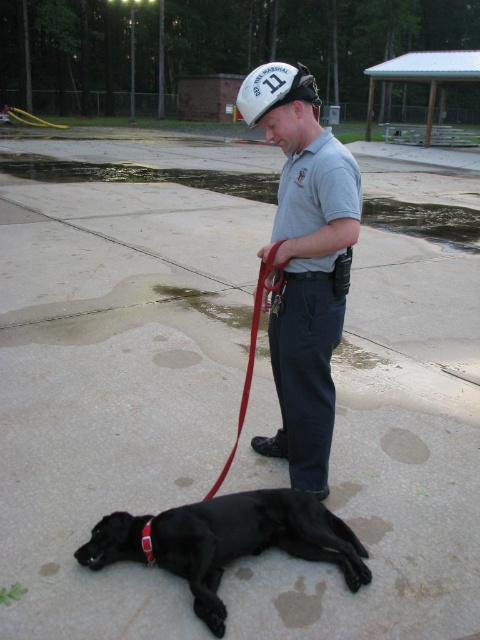
You are a photographer trying to capture a closeup shot of the black smooth dog at lower center and the white matte baseball cap at center. Your camera has a maximum focus range of 1 meter. Can you fit both objects into the frame without moving the camera?

The black smooth dog at lower center is narrower than the white matte baseball cap at center, so if they are positioned side by side within the 1 meter focus range, the camera can capture both in the frame.

Looking at this image, you are a safety inspector checking the scene. The black smooth dog at lower center and the red leather leash at center are in your view. According to safety protocols, the leash must be kept taut to prevent the dog from wandering. Is the current position of the dog relative to the leash compliant with this requirement?

The black smooth dog at lower center is positioned on the left side of red leather leash at center. Since the leash is at the center and the dog is to the left, the leash is not taut, so it does not comply with safety protocols requiring the leash to be kept taut.

Looking at this image, you are a drone operator trying to locate the black dog in the image. The drone has a camera with a zoom lens that can focus on specific coordinates. The coordinates are given as a point between 0 and 1 in both x and y axes, where the origin is the bottom left corner of the image. You need to determine if the point provided corresponds to the location of the black dog. Is the point at coordinates (227, 541) the location of the black dog?

Yes, the point at coordinates (227, 541) indicates the black smooth dog at lower center, so the coordinates correspond to the location of the black dog.